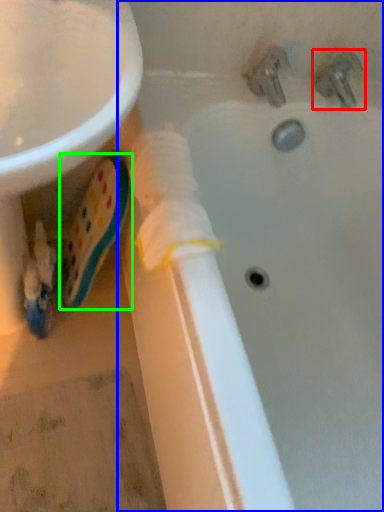
Question: Estimate the real-world distances between objects in this image. Which object is farther from tap (highlighted by a red box), bathtub (highlighted by a blue box) or toothpaste (highlighted by a green box)?

Choices:
 (A) bathtub
 (B) toothpaste

Answer: (B)